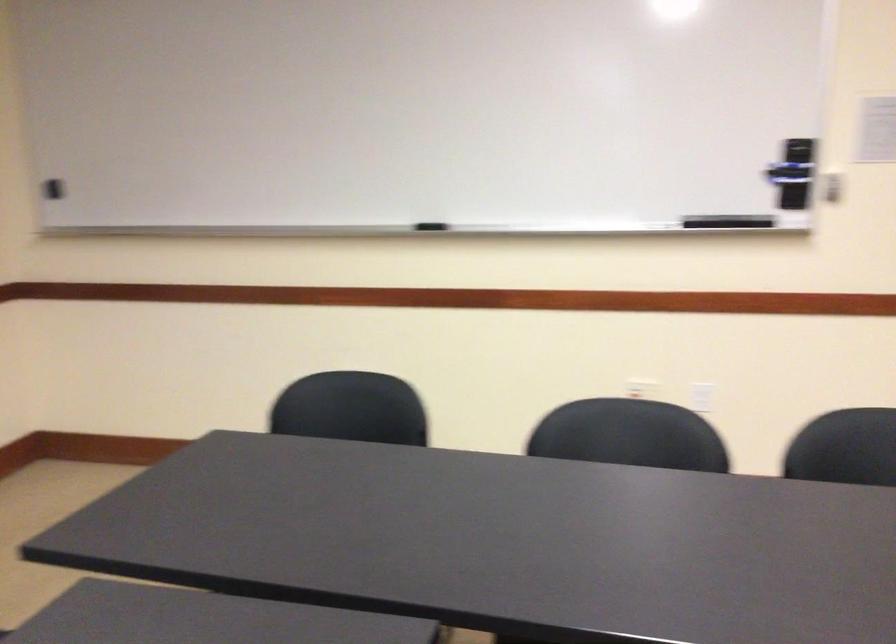
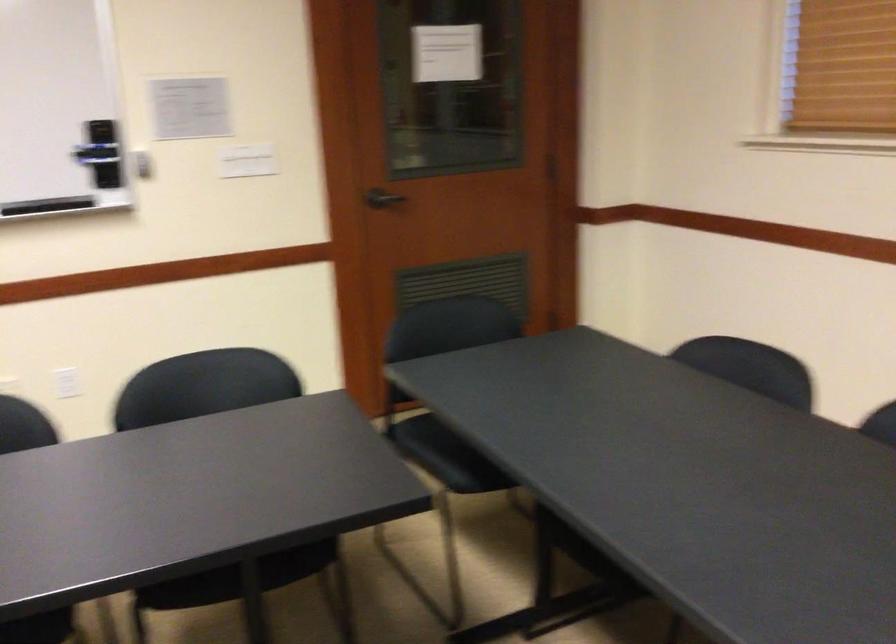
Find the pixel in the second image that matches point (707, 408) in the first image.

(66, 383)